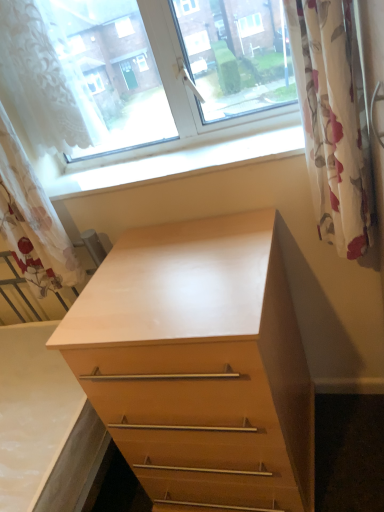
Question: Can you confirm if light wood chest of drawers at center is wider than white lace curtain at upper left?

Choices:
 (A) no
 (B) yes

Answer: (B)

Question: From the image's perspective, does light wood chest of drawers at center appear higher than white lace curtain at upper left?

Choices:
 (A) yes
 (B) no

Answer: (B)

Question: From a real-world perspective, is light wood chest of drawers at center on white lace curtain at upper left?

Choices:
 (A) yes
 (B) no

Answer: (B)

Question: Is light wood chest of drawers at center at the left side of white lace curtain at upper left?

Choices:
 (A) no
 (B) yes

Answer: (A)

Question: Is light wood chest of drawers at center further to the viewer compared to white lace curtain at upper left?

Choices:
 (A) yes
 (B) no

Answer: (B)

Question: Considering the positions of floral fabric curtain at right, which is the first curtain in right-to-left order, and white lace curtain at left, the 1th curtain in the left-to-right sequence, in the image, is floral fabric curtain at right, which is the first curtain in right-to-left order, wider or thinner than white lace curtain at left, the 1th curtain in the left-to-right sequence,?

Choices:
 (A) thin
 (B) wide

Answer: (A)

Question: Is floral fabric curtain at right, which is the first curtain in right-to-left order, in front of or behind white lace curtain at left, which is the second curtain from right to left, in the image?

Choices:
 (A) behind
 (B) front

Answer: (B)

Question: Would you say floral fabric curtain at right, positioned as the second curtain in left-to-right order, is inside or outside white lace curtain at left, the 1th curtain in the left-to-right sequence?

Choices:
 (A) outside
 (B) inside

Answer: (A)

Question: From a real-world perspective, relative to white lace curtain at left, the 1th curtain in the left-to-right sequence, is floral fabric curtain at right, positioned as the second curtain in left-to-right order, vertically above or below?

Choices:
 (A) above
 (B) below

Answer: (B)

Question: Is point (331, 172) closer or farther from the camera than point (44, 45)?

Choices:
 (A) closer
 (B) farther

Answer: (A)

Question: Considering the positions of floral fabric curtain at right, which is the first curtain in right-to-left order, and white lace curtain at upper left in the image, is floral fabric curtain at right, which is the first curtain in right-to-left order, taller or shorter than white lace curtain at upper left?

Choices:
 (A) short
 (B) tall

Answer: (B)

Question: Is floral fabric curtain at right, positioned as the second curtain in left-to-right order, spatially inside white lace curtain at upper left, or outside of it?

Choices:
 (A) outside
 (B) inside

Answer: (A)

Question: Is floral fabric curtain at right, which is the first curtain in right-to-left order, to the left or to the right of white lace curtain at upper left in the image?

Choices:
 (A) right
 (B) left

Answer: (A)

Question: Is white lace curtain at left, which is the second curtain from right to left, inside or outside of white lace curtain at upper left?

Choices:
 (A) outside
 (B) inside

Answer: (A)

Question: Based on their positions, is white lace curtain at left, the 1th curtain in the left-to-right sequence, located to the left or right of white lace curtain at upper left?

Choices:
 (A) right
 (B) left

Answer: (B)